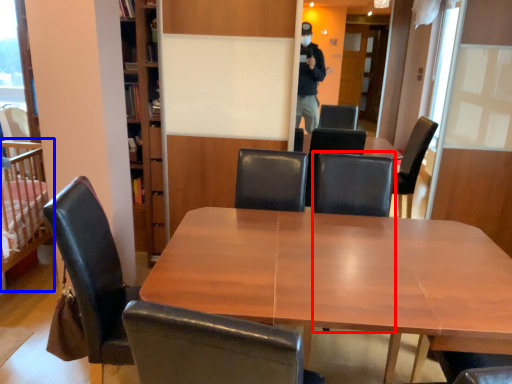
Question: Which object appears farthest to the camera in this image, armchair (highlighted by a red box) or infant bed (highlighted by a blue box)?

Choices:
 (A) armchair
 (B) infant bed

Answer: (B)